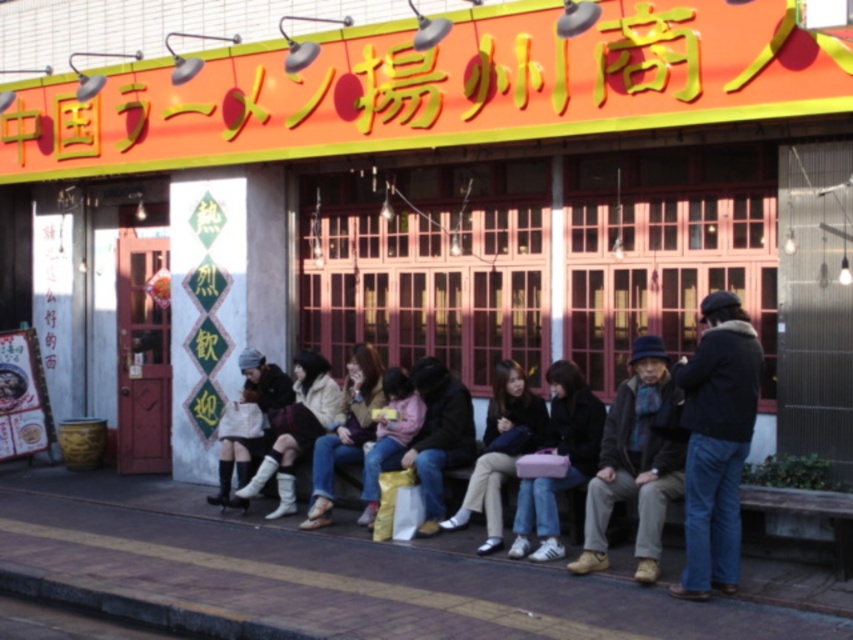
You are a delivery person who needs to place a small package between the pink fabric bag at center and the light brown leather jacket at center. Which object should you place it next to to ensure it fits without overlapping?

The pink fabric bag at center has a lesser width compared to the light brown leather jacket at center, so placing the small package next to the pink fabric bag at center would provide enough space without overlapping.

You are standing at the entrance of the restaurant and want to hand a menu to the person wearing the black fuzzy jacket at right and the light brown leather jacket at center. If you can only reach up to 6 feet, can you hand both menus without moving from your spot?

The black fuzzy jacket at right is 5.85 feet away from the light brown leather jacket at center. Since you can reach up to 6 feet, you can hand both menus without moving from your spot because the distance between them is within your reach.